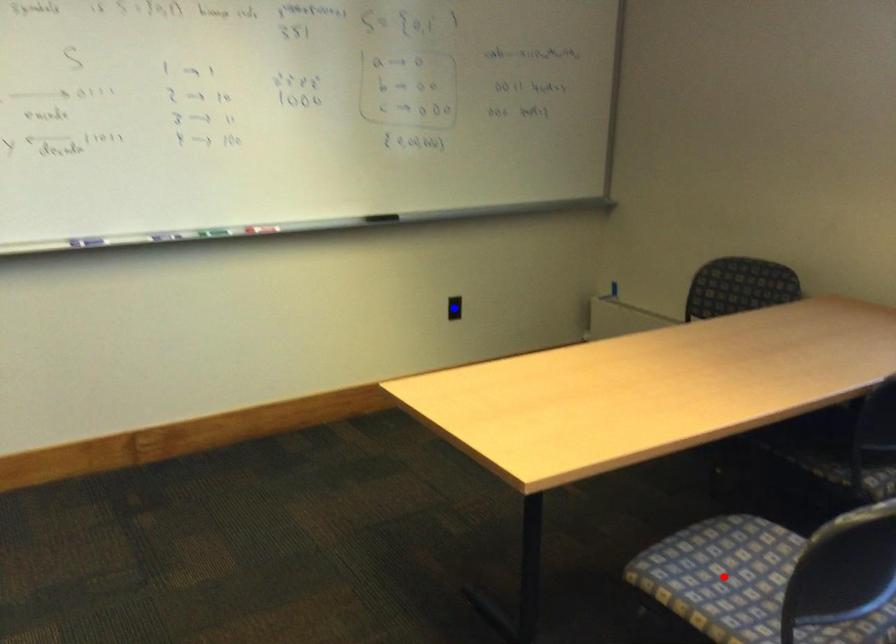
Question: Which of the two points in the image is closer to the camera?

Choices:
 (A) Blue point is closer.
 (B) Red point is closer.

Answer: (B)